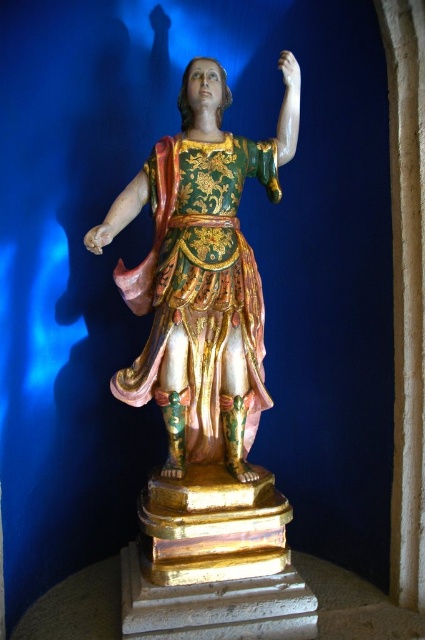
Question: From the image, what is the correct spatial relationship of gilded wood statue at center in relation to gold textured fabric robe at center?

Choices:
 (A) below
 (B) above

Answer: (A)

Question: Which object appears closest to the camera in this image?

Choices:
 (A) gilded wood statue at center
 (B) gold textured fabric robe at center

Answer: (A)

Question: Can you confirm if gilded wood statue at center is smaller than gold textured fabric robe at center?

Choices:
 (A) no
 (B) yes

Answer: (A)

Question: From the image, what is the correct spatial relationship of gilded wood statue at center in relation to gold textured fabric robe at center?

Choices:
 (A) left
 (B) right

Answer: (A)